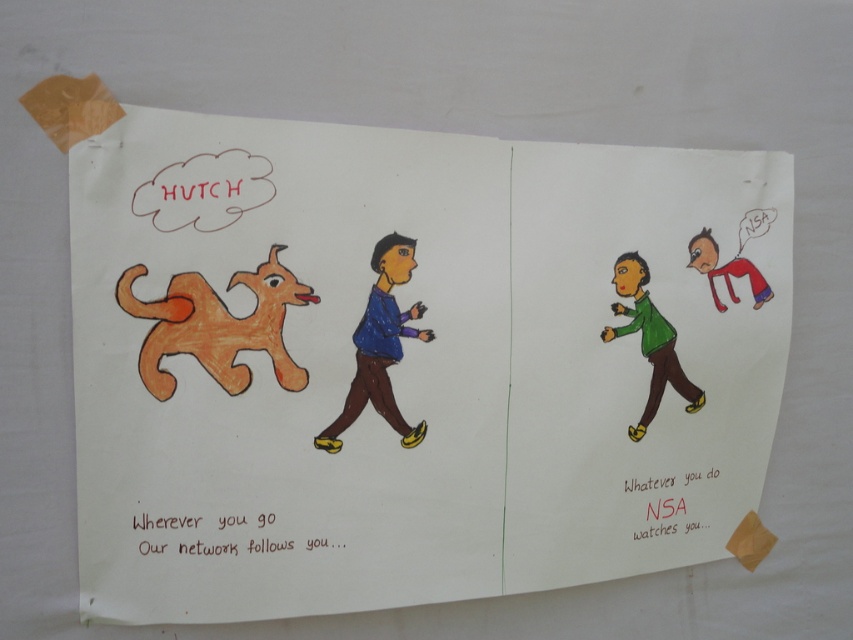
Based on the photo, you are an artist reviewing a comic strip. You notice two characters wearing shirts of different colors. Which shirt, the matte blue shirt at center or the green matte shirt at center, appears to be in front of the other?

The matte blue shirt at center is closer to the viewer than the green matte shirt at center, so the matte blue shirt at center appears in front of the green matte shirt at center.